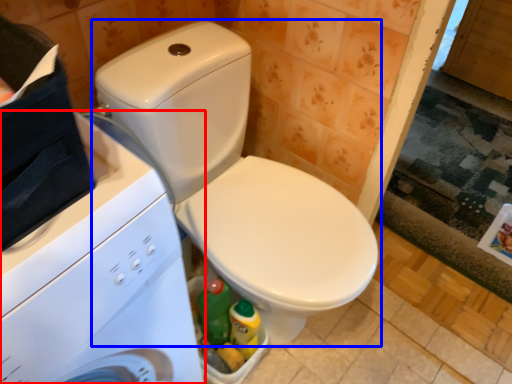
Question: Among these objects, which one is nearest to the camera, washing machine (highlighted by a red box) or toilet (highlighted by a blue box)?

Choices:
 (A) washing machine
 (B) toilet

Answer: (A)